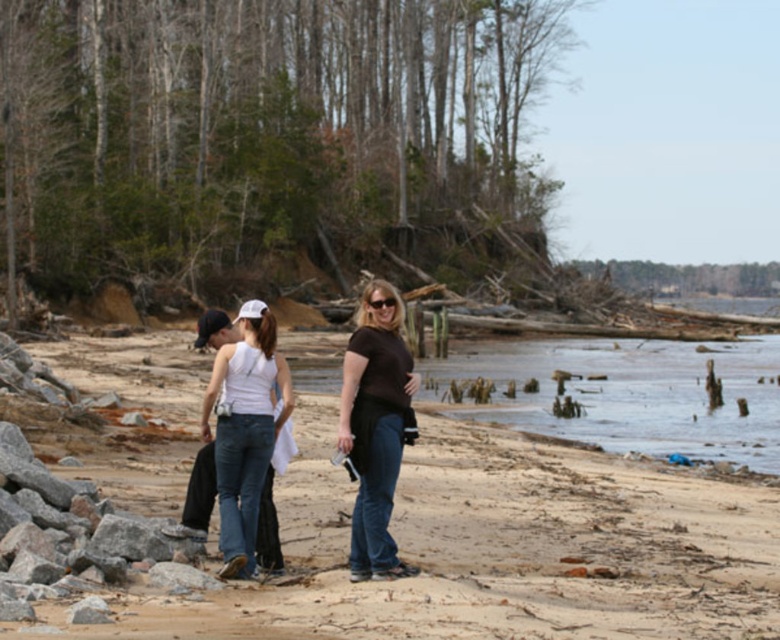
You are a photographer trying to capture a group photo of the three people at the beach. You notice the matte brown shirt at center and the white denim jeans at center. Which object should you focus on to ensure it takes up more of the frame?

The white denim jeans at center occupies more space than the matte brown shirt at center, so focusing on the white denim jeans at center would ensure it takes up more of the frame.

You are standing at the point labeled point (401, 403) on the beach. You want to walk to the point labeled point (775, 465). Which direction should you face to walk directly towards your destination?

You should face towards the back direction because point (775, 465) is behind point (401, 403).

You are a photographer trying to capture a group photo of the three people at the beach. You want to ensure that the person wearing the matte brown shirt at center is centered in the frame. According to the coordinates provided, where should you position the camera to achieve this?

To center the matte brown shirt at center, position the camera so that the center of the frame aligns with the coordinates point (374, 428).